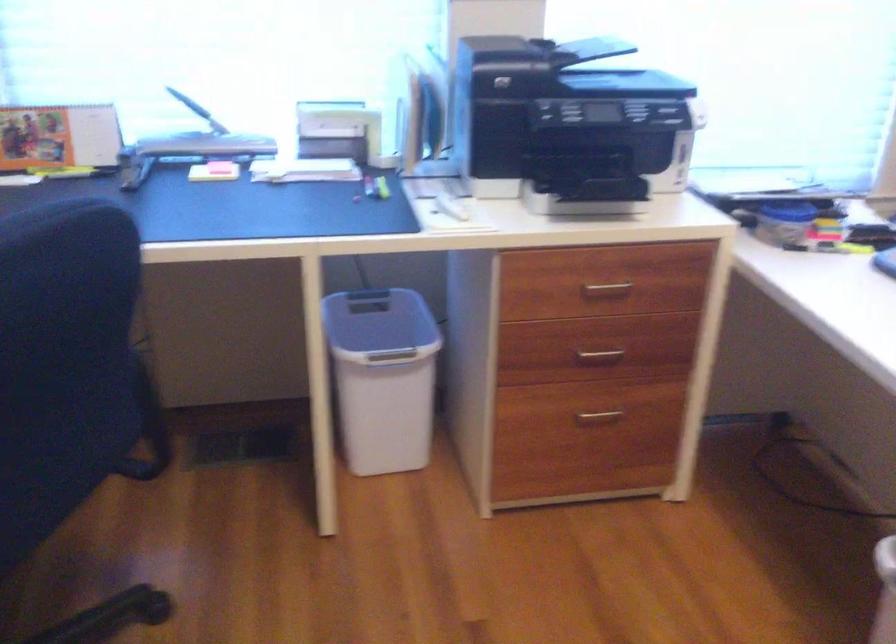
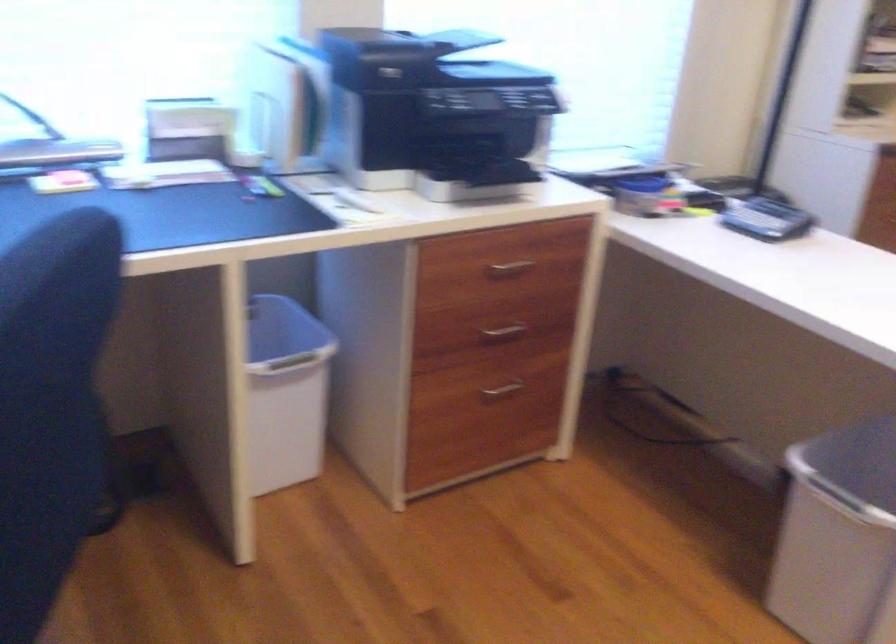
Question: The camera is either moving clockwise (left) or counter-clockwise (right) around the object. The first image is from the beginning of the video and the second image is from the end. Is the camera moving left or right when shooting the video?

Choices:
 (A) Left
 (B) Right

Answer: (A)